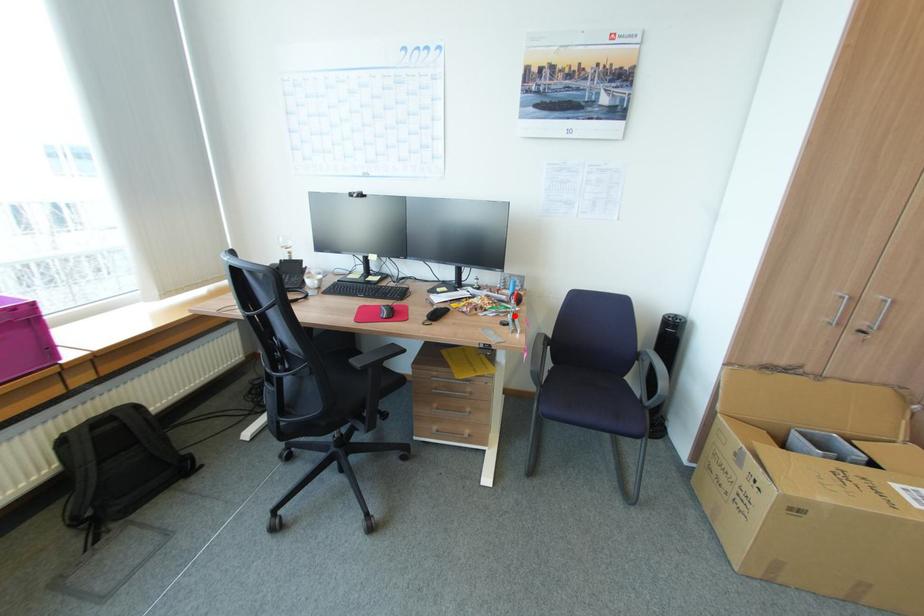
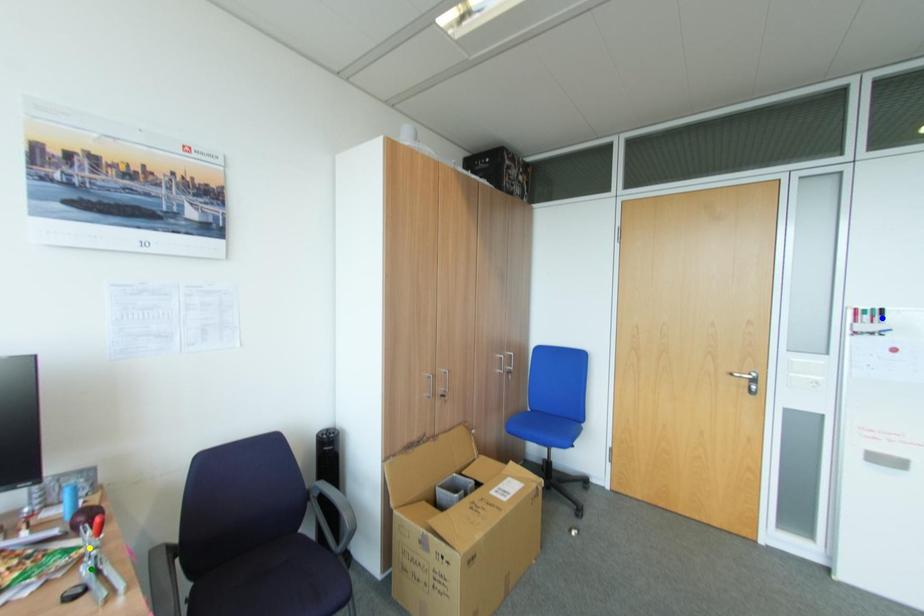
Question: I am providing you with two images of the same scene from different viewpoints. A red point is marked on the first image. You are given multiple points on the second image. Which point in image 2 is actually the same real-world point as the red point in image 1?

Choices:
 (A) yellow point
 (B) blue point
 (C) green point

Answer: (C)